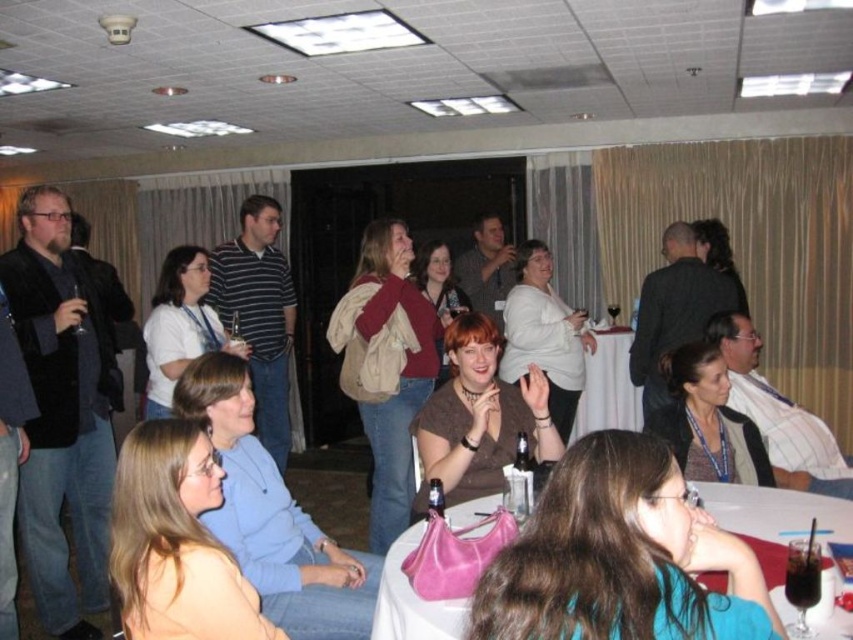
Can you confirm if blonde hair at lower left is positioned below striped cotton shirt at center?

Yes, blonde hair at lower left is below striped cotton shirt at center.

Can you confirm if blonde hair at lower left is smaller than striped cotton shirt at center?

Yes.

The image size is (853, 640). I want to click on blonde hair at lower left, so click(177, 541).

Can you confirm if white tablecloth at center is bigger than clear plastic bottle at center?

Yes.

Who is higher up, white tablecloth at center or clear plastic bottle at center?

white tablecloth at center

Identify the location of white tablecloth at center. The height and width of the screenshot is (640, 853). (608, 387).

In the scene shown: Who is taller, brown matte shirt at center or white plastic table at lower right?

brown matte shirt at center is taller.

Is point (457, 426) in front of point (387, 612)?

No.

Who is more distant from viewer, (x=450, y=481) or (x=784, y=529)?

The point (x=450, y=481) is behind.

Locate an element on the screen. The image size is (853, 640). brown matte shirt at center is located at coordinates (479, 417).